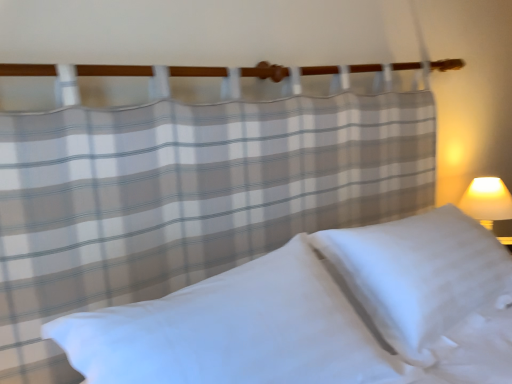
Question: Does white smooth pillow at center, the first pillow from the left, have a larger size compared to white soft pillow at lower right, marked as the 2th pillow in a left-to-right arrangement?

Choices:
 (A) yes
 (B) no

Answer: (B)

Question: Is white smooth pillow at center, the first pillow from the left, to the left of white soft pillow at lower right, marked as the 2th pillow in a left-to-right arrangement, from the viewer's perspective?

Choices:
 (A) no
 (B) yes

Answer: (B)

Question: Is white smooth pillow at center, the first pillow from the left, directly adjacent to white soft pillow at lower right, marked as the 2th pillow in a left-to-right arrangement?

Choices:
 (A) yes
 (B) no

Answer: (B)

Question: Would you say white soft pillow at lower right, marked as the 2th pillow in a left-to-right arrangement, is part of white smooth pillow at center, arranged as the second pillow when viewed from the right,'s contents?

Choices:
 (A) no
 (B) yes

Answer: (A)

Question: From the image's perspective, is white smooth pillow at center, the first pillow from the left, under white soft pillow at lower right, which is the 1th pillow from right to left?

Choices:
 (A) no
 (B) yes

Answer: (B)

Question: Is white smooth pillow at center, the first pillow from the left, aimed at white soft pillow at lower right, which is the 1th pillow from right to left?

Choices:
 (A) yes
 (B) no

Answer: (B)

Question: Does white soft pillow at lower right, marked as the 2th pillow in a left-to-right arrangement, have a greater height compared to white smooth pillow at center, the first pillow from the left?

Choices:
 (A) yes
 (B) no

Answer: (A)

Question: From the image's perspective, would you say white soft pillow at lower right, which is the 1th pillow from right to left, is shown under white smooth pillow at center, the first pillow from the left?

Choices:
 (A) yes
 (B) no

Answer: (B)

Question: From the image's perspective, is white soft pillow at lower right, marked as the 2th pillow in a left-to-right arrangement, above white smooth pillow at center, arranged as the second pillow when viewed from the right?

Choices:
 (A) no
 (B) yes

Answer: (B)

Question: Is white soft pillow at lower right, marked as the 2th pillow in a left-to-right arrangement, with white smooth pillow at center, the first pillow from the left?

Choices:
 (A) no
 (B) yes

Answer: (A)

Question: Is white soft pillow at lower right, marked as the 2th pillow in a left-to-right arrangement, positioned far away from white smooth pillow at center, arranged as the second pillow when viewed from the right?

Choices:
 (A) no
 (B) yes

Answer: (A)

Question: Could you tell me if white soft pillow at lower right, marked as the 2th pillow in a left-to-right arrangement, is turned towards white smooth pillow at center, arranged as the second pillow when viewed from the right?

Choices:
 (A) yes
 (B) no

Answer: (B)

Question: Considering their positions, is white smooth pillow at center, arranged as the second pillow when viewed from the right, located in front of or behind white soft pillow at lower right, which is the 1th pillow from right to left?

Choices:
 (A) front
 (B) behind

Answer: (A)